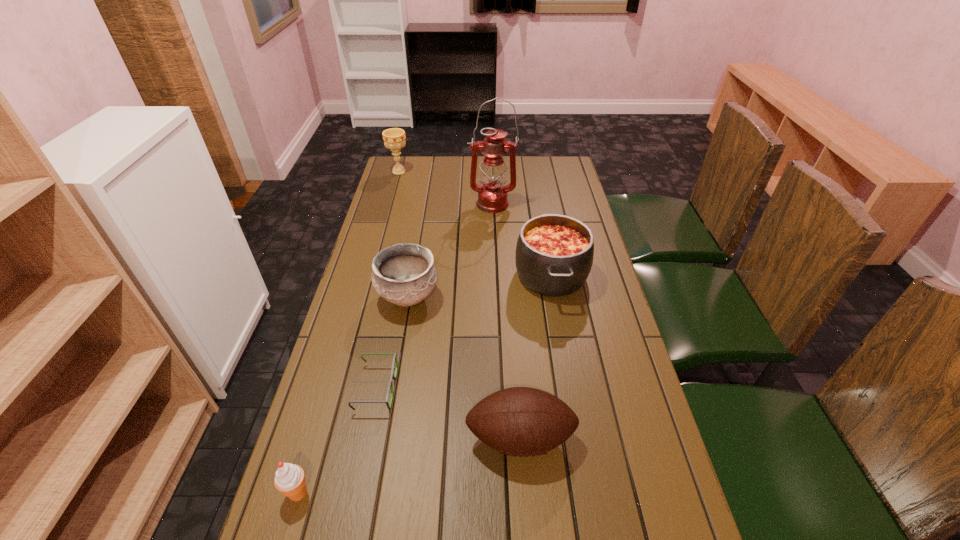
This screenshot has width=960, height=540. Identify the location of oil lamp. (492, 197).

The image size is (960, 540). Find the location of `the sixth nearest object`. the sixth nearest object is located at coordinates (492, 197).

I want to click on the farthest object, so click(x=394, y=138).

This screenshot has height=540, width=960. What are the coordinates of `casserole` in the screenshot? It's located at tap(554, 253).

Locate an element on the screen. Image resolution: width=960 pixels, height=540 pixels. pottery is located at coordinates (404, 274).

Where is `football`? football is located at coordinates (520, 421).

Locate an element on the screen. This screenshot has width=960, height=540. icecream is located at coordinates (290, 480).

The image size is (960, 540). What are the coordinates of `the shortest object` in the screenshot? It's located at (393, 376).

Locate an element on the screen. This screenshot has width=960, height=540. free space located 0.220m on the back of the sixth nearest object is located at coordinates click(x=491, y=168).

Locate an element on the screen. The height and width of the screenshot is (540, 960). blank space located 0.060m on the right of the chalice is located at coordinates (424, 172).